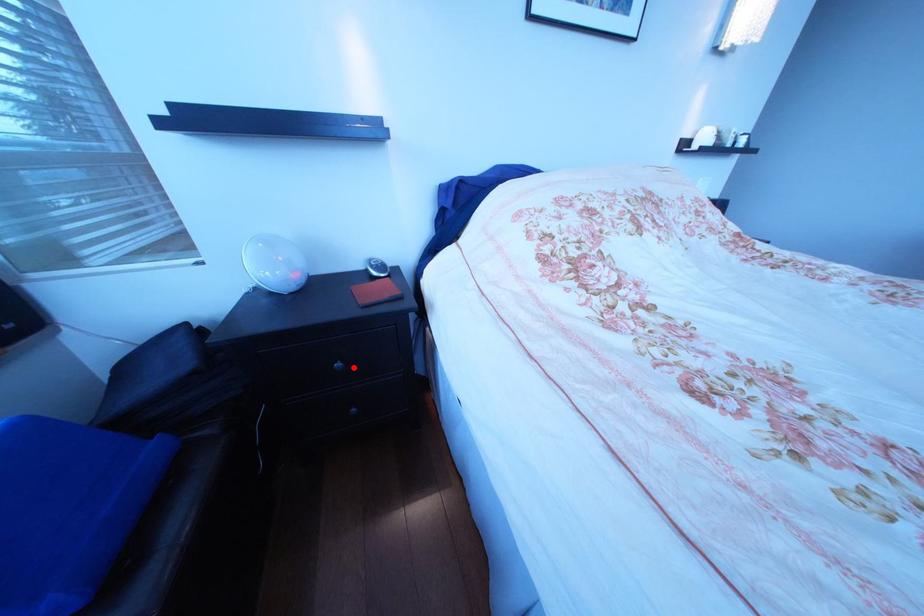
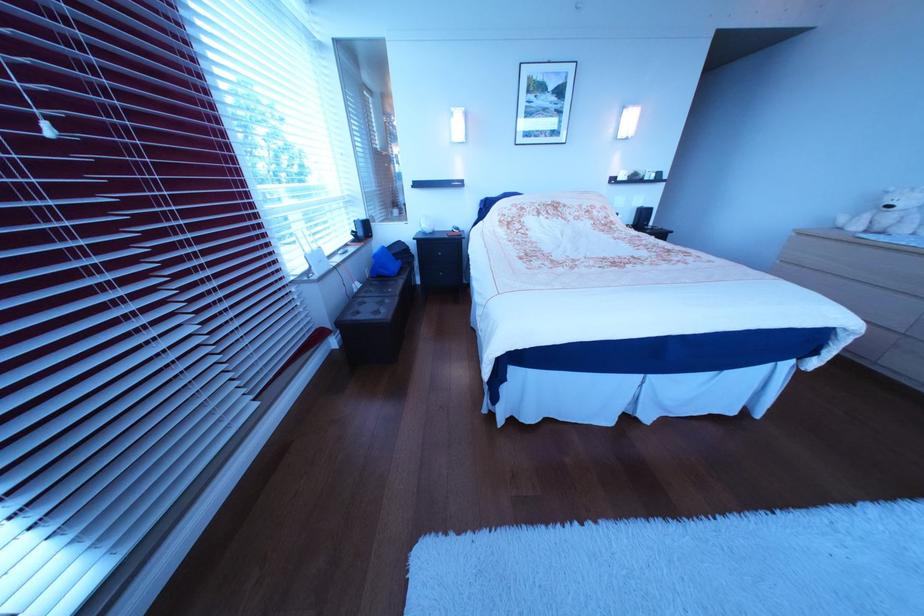
The point at the highlighted location is marked in the first image. Where is the corresponding point in the second image?

(456, 256)